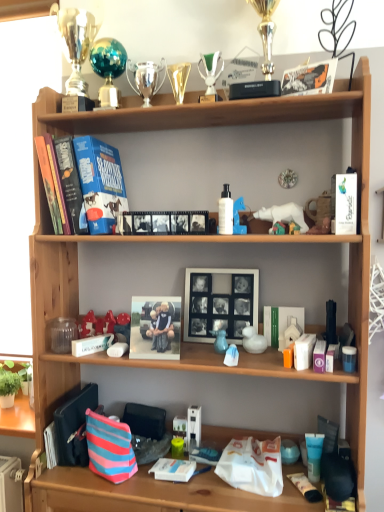
Question: Is matte plastic tube at lower right, which is the first toiletry in bottom-to-top order, bigger than matte brown figurine at upper right, positioned as the 8th toy in left-to-right order?

Choices:
 (A) yes
 (B) no

Answer: (B)

Question: Does matte plastic tube at lower right, the third toiletry positioned from the right, have a lesser height compared to matte brown figurine at upper right, placed as the fifth toy when sorted from bottom to top?

Choices:
 (A) yes
 (B) no

Answer: (A)

Question: Is matte plastic tube at lower right, which ranks as the 2th toiletry in left-to-right order, aimed at matte brown figurine at upper right, positioned as the 8th toy in left-to-right order?

Choices:
 (A) yes
 (B) no

Answer: (B)

Question: Considering the relative positions of matte plastic tube at lower right, which is the first toiletry in bottom-to-top order, and matte brown figurine at upper right, placed as the fifth toy when sorted from bottom to top, in the image provided, is matte plastic tube at lower right, which is the first toiletry in bottom-to-top order, in front of matte brown figurine at upper right, placed as the fifth toy when sorted from bottom to top,?

Choices:
 (A) no
 (B) yes

Answer: (B)

Question: Can you confirm if matte plastic tube at lower right, the 4th toiletry positioned from the top, is smaller than matte brown figurine at upper right, positioned as the 8th toy in left-to-right order?

Choices:
 (A) yes
 (B) no

Answer: (A)

Question: Does matte plastic tube at lower right, which is the first toiletry in bottom-to-top order, appear on the right side of matte brown figurine at upper right, positioned as the 8th toy in left-to-right order?

Choices:
 (A) yes
 (B) no

Answer: (B)

Question: Is white plastic duck at center, the 3th toy positioned from the right, thinner than white matte paperback book at upper right, the second paperback book in the back-to-front sequence?

Choices:
 (A) no
 (B) yes

Answer: (A)

Question: Considering the relative positions of white plastic duck at center, the 6th toy in the left-to-right sequence, and white matte paperback book at upper right, the 1th paperback book in the front-to-back sequence, in the image provided, is white plastic duck at center, the 6th toy in the left-to-right sequence, to the left of white matte paperback book at upper right, the 1th paperback book in the front-to-back sequence, from the viewer's perspective?

Choices:
 (A) no
 (B) yes

Answer: (B)

Question: Does white plastic duck at center, positioned as the eighth toy in top-to-bottom order, have a larger size compared to white matte paperback book at upper right, the second paperback book in the back-to-front sequence?

Choices:
 (A) yes
 (B) no

Answer: (B)

Question: Is white plastic duck at center, the 6th toy in the left-to-right sequence, wider than white matte paperback book at upper right, placed as the first paperback book when sorted from right to left?

Choices:
 (A) yes
 (B) no

Answer: (A)

Question: Could you tell me if white plastic duck at center, which appears as the 1th toy when ordered from the bottom, is turned towards white matte paperback book at upper right, the second paperback book in the back-to-front sequence?

Choices:
 (A) no
 (B) yes

Answer: (A)

Question: From a real-world perspective, is white plastic duck at center, the 3th toy positioned from the right, physically above white matte paperback book at upper right, the 2th paperback book positioned from the left?

Choices:
 (A) yes
 (B) no

Answer: (B)

Question: Does white matte picture frame at center have a smaller size compared to hardcover book at upper left, which is the 2th paperback book from right to left?

Choices:
 (A) yes
 (B) no

Answer: (A)